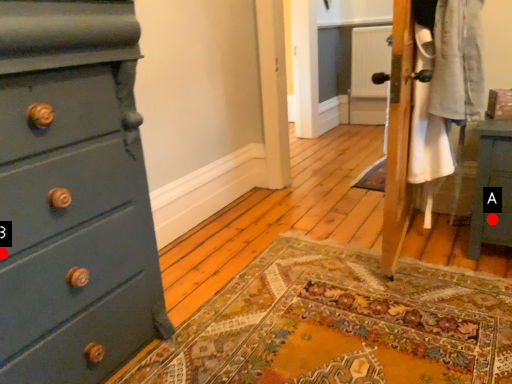
Question: Two points are circled on the image, labeled by A and B beside each circle. Which point is farther to the camera?

Choices:
 (A) A is further
 (B) B is further

Answer: (A)